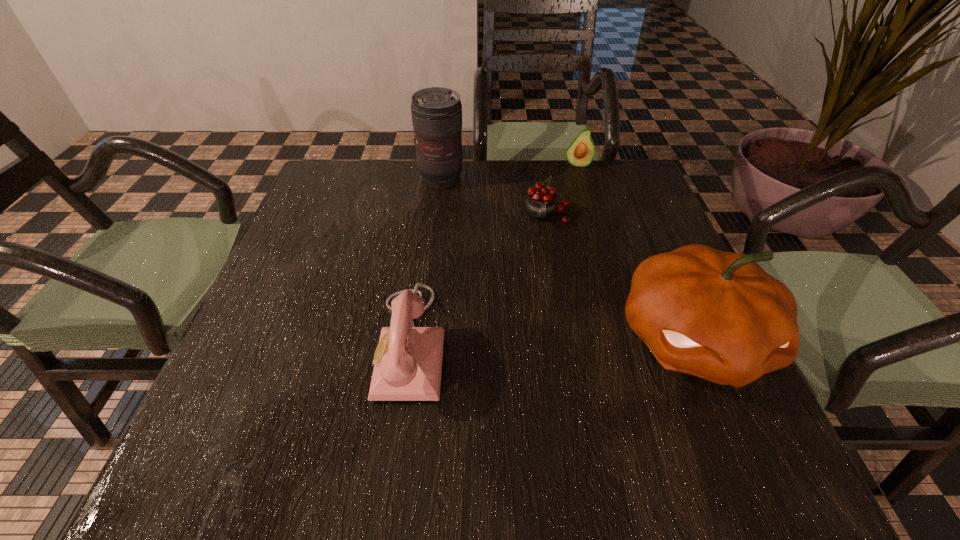
The width and height of the screenshot is (960, 540). I want to click on vacant spot on the desktop that is between the telephone and the pumpkin and is positioned on the handle side of the third farthest object, so click(x=559, y=341).

At what (x,y) coordinates should I click in order to perform the action: click on vacant spot on the desktop that is between the telephone and the pumpkin and is positioned on the cut side of the avocado. Please return your answer as a coordinate pair (x, y). Looking at the image, I should click on (592, 340).

You are a GUI agent. You are given a task and a screenshot of the screen. Output one action in this format:
    pyautogui.click(x=<x>, y=<y>)
    Task: Click on the vacant spot on the desktop that is between the third tallest object and the pumpkin and is positioned on the side of the telephoto lens where the control switches are located
    
    Given the screenshot: What is the action you would take?
    [x=568, y=341]